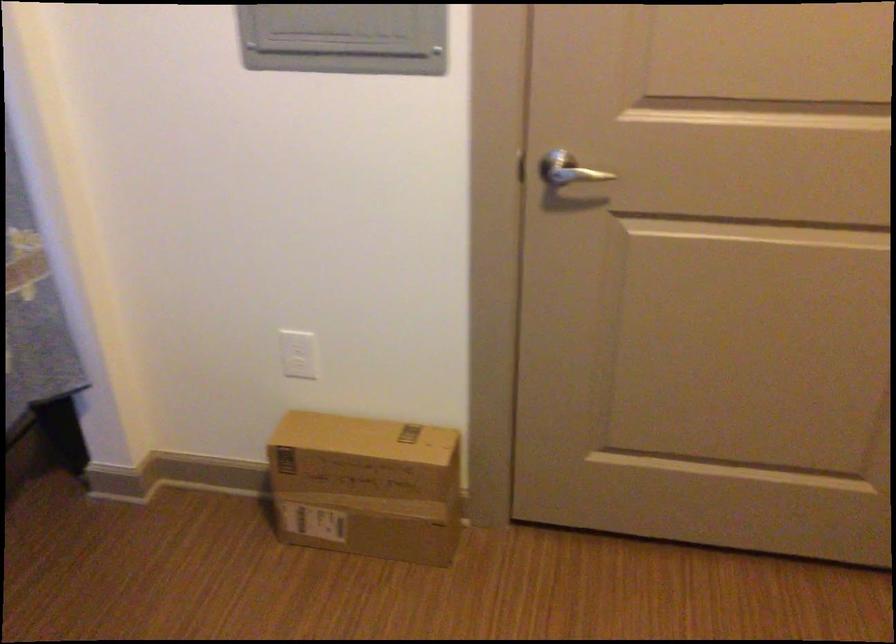
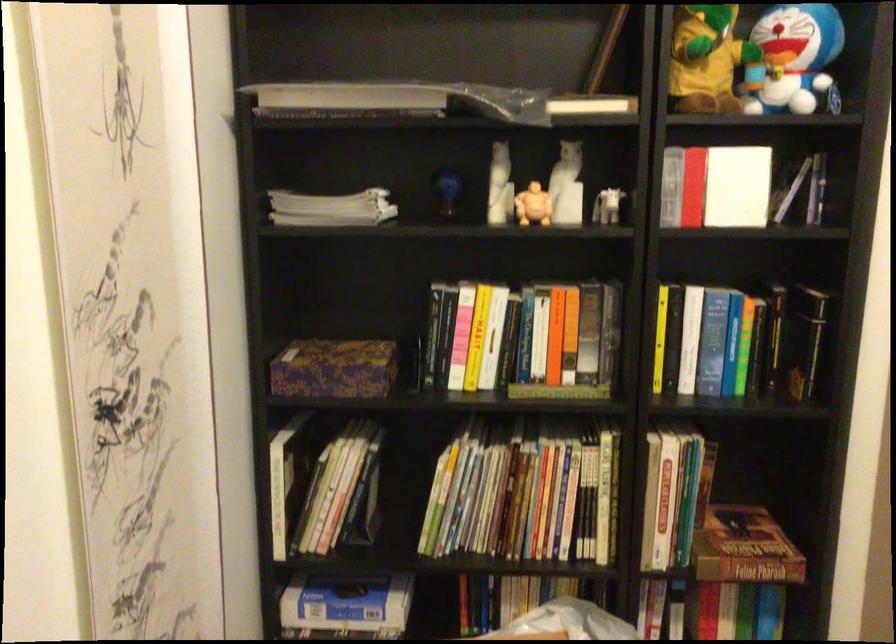
Question: The camera is either moving clockwise (left) or counter-clockwise (right) around the object. The first image is from the beginning of the video and the second image is from the end. Is the camera moving left or right when shooting the video?

Choices:
 (A) Left
 (B) Right

Answer: (A)